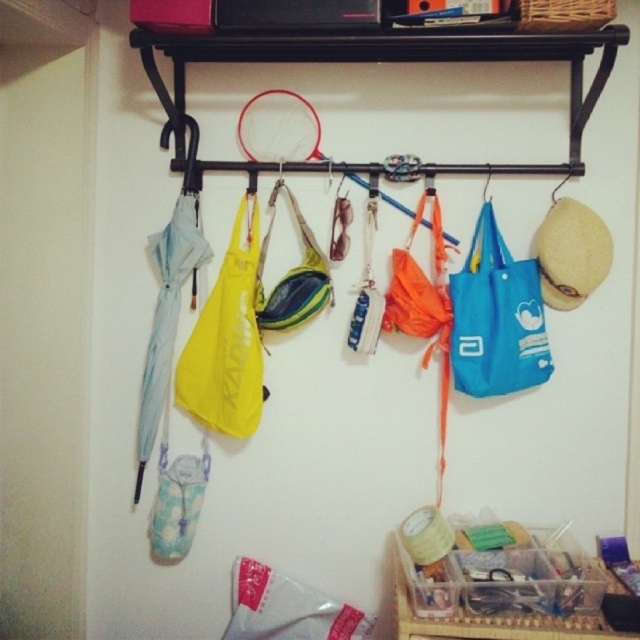
You are rearranging items in the room and want to place a new rectangular box that is 1 meter wide. You have two options for placement areas based on the existing objects. Which object, the black metal shelf at upper center or the clear plastic container at lower center, has a wider space that can accommodate the box?

The black metal shelf at upper center has a greater width than the clear plastic container at lower center, so the box can be placed there.